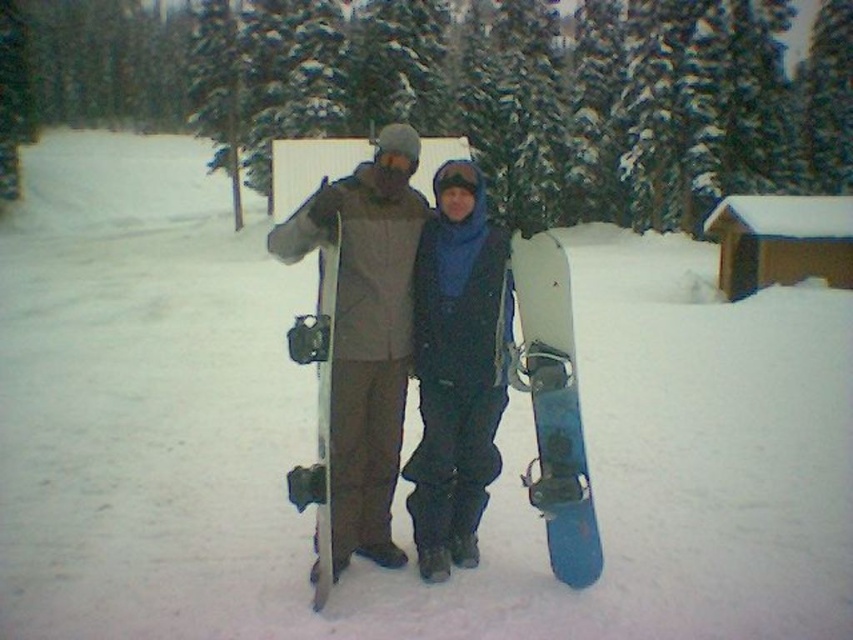
You are planning to take a photo of the two snowboards at the center of the image. Which snowboard, the matte gray snowboard at center or the white matte snowboard at center, should you focus on if you want to capture the taller one?

The matte gray snowboard at center is taller than the white matte snowboard at center, so you should focus on the matte gray snowboard at center to capture the taller one.

You are planning to rent a snowboard for your upcoming winter trip. You see two snowboards in the image, the matte black snowboard at center and the blue matte snowboard at center. Which one is bigger in size?

The matte black snowboard at center is larger in size compared to the blue matte snowboard at center.

You are planning to take a photo of the matte black snowboard at center. Based on the coordinates provided in the Objects Description, where exactly should you position your camera to capture the snowboard in the frame?

The matte black snowboard at center is located at point coordinates of (457, 346). Position your camera so that the center of the frame aligns with these coordinates to capture the snowboard clearly.